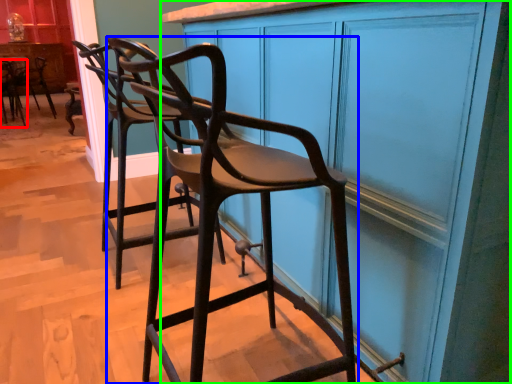
Question: Based on their relative distances, which object is nearer to chair (highlighted by a red box)? Choose from chair (highlighted by a blue box) and cabinetry (highlighted by a green box).

Choices:
 (A) chair
 (B) cabinetry

Answer: (A)